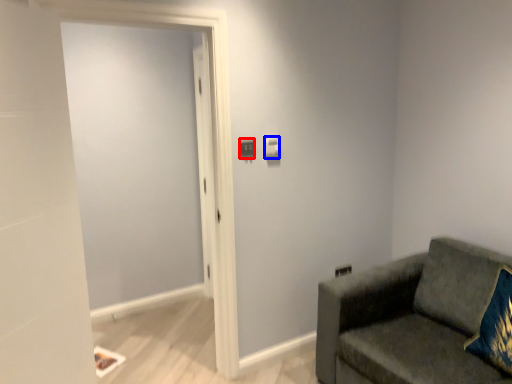
Question: Which of the following is the closest to the observer, light switch (highlighted by a red box) or light switch (highlighted by a blue box)?

Choices:
 (A) light switch
 (B) light switch

Answer: (A)